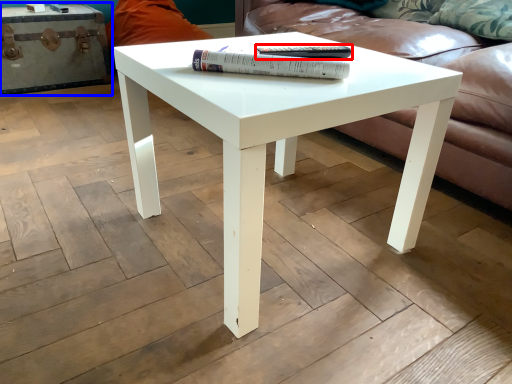
Question: Which object is closer to the camera taking this photo, paperback book (highlighted by a red box) or chest (highlighted by a blue box)?

Choices:
 (A) paperback book
 (B) chest

Answer: (A)